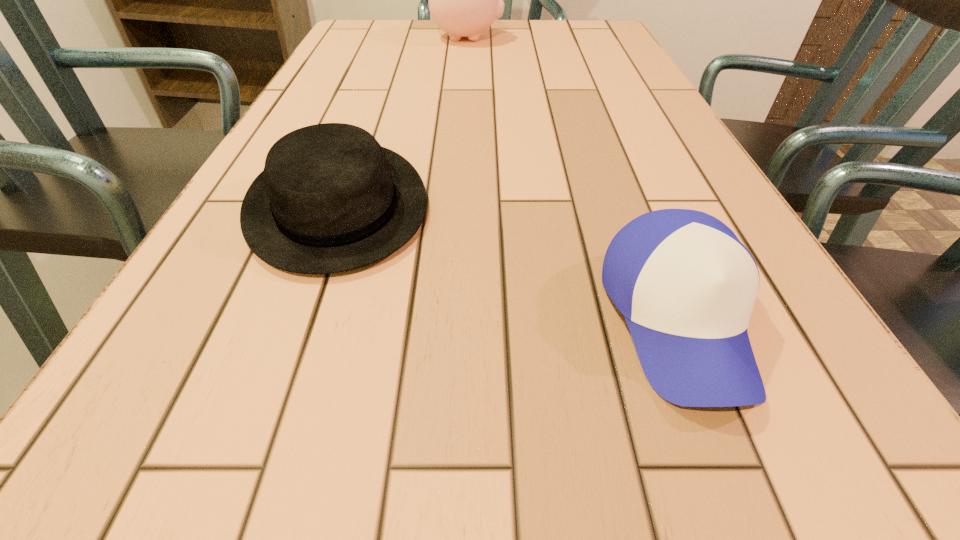
Where is `free space between the rightmost object and the farthest object`? The height and width of the screenshot is (540, 960). free space between the rightmost object and the farthest object is located at coordinates (572, 179).

Where is `vacant space in between the rightmost object and the tallest object`? Image resolution: width=960 pixels, height=540 pixels. vacant space in between the rightmost object and the tallest object is located at coordinates (572, 179).

Locate an element on the screen. The height and width of the screenshot is (540, 960). blank region between the farthest object and the fedora is located at coordinates (402, 122).

I want to click on vacant space in between the tallest object and the fedora, so click(402, 122).

Identify the location of free space between the farthest object and the rightmost object. The width and height of the screenshot is (960, 540). (572, 179).

Where is `free space between the fedora and the rightmost object`? free space between the fedora and the rightmost object is located at coordinates pyautogui.click(x=507, y=262).

I want to click on object that is the closest one to the fedora, so click(686, 285).

You are a GUI agent. You are given a task and a screenshot of the screen. Output one action in this format:
    pyautogui.click(x=<x>, y=<y>)
    Task: Click on the object identified as the closest to the rightmost object
    The height and width of the screenshot is (540, 960).
    Given the screenshot: What is the action you would take?
    pyautogui.click(x=330, y=199)

What are the coordinates of `free space in the image that satisfies the following two spatial constraints: 1. at the snout of the piggy bank; 2. on the front side of the fedora` in the screenshot? It's located at (458, 205).